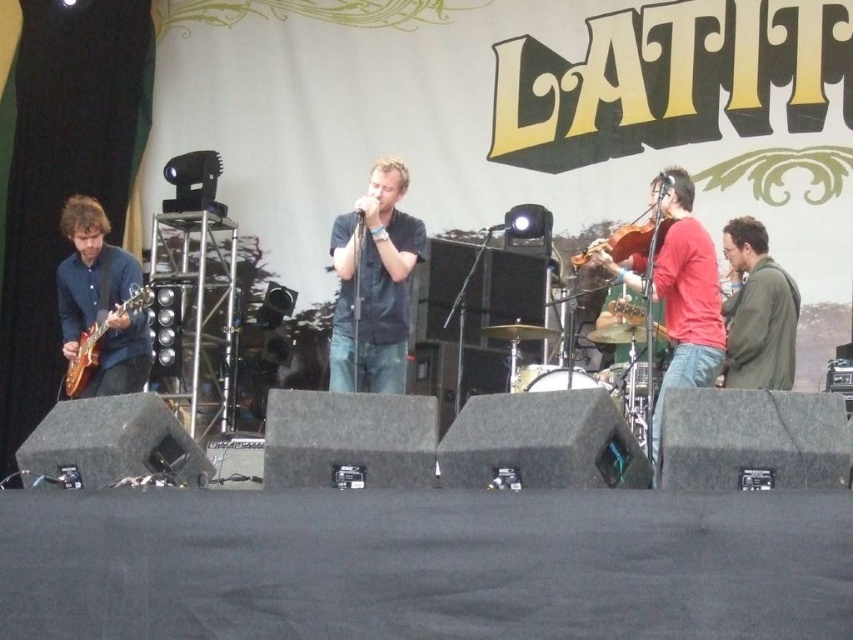
Question: Which point appears farthest from the camera in this image?

Choices:
 (A) click(x=144, y=307)
 (B) click(x=379, y=198)
 (C) click(x=672, y=268)
 (D) click(x=788, y=310)

Answer: (B)

Question: Is dark blue shirt at center positioned in front of electric wood guitar at left?

Choices:
 (A) yes
 (B) no

Answer: (B)

Question: Which of the following is the farthest from the observer?

Choices:
 (A) [x=705, y=292]
 (B) [x=397, y=253]
 (C) [x=70, y=388]
 (D) [x=645, y=266]

Answer: (B)

Question: Is green matte jacket at right closer to the viewer compared to brown wooden violin at center right?

Choices:
 (A) yes
 (B) no

Answer: (A)

Question: Which point is closer to the camera?

Choices:
 (A) (660, 244)
 (B) (704, 268)
 (C) (80, 365)
 (D) (747, 365)

Answer: (B)

Question: Is red matte violin at center smaller than brown wooden violin at center right?

Choices:
 (A) no
 (B) yes

Answer: (A)